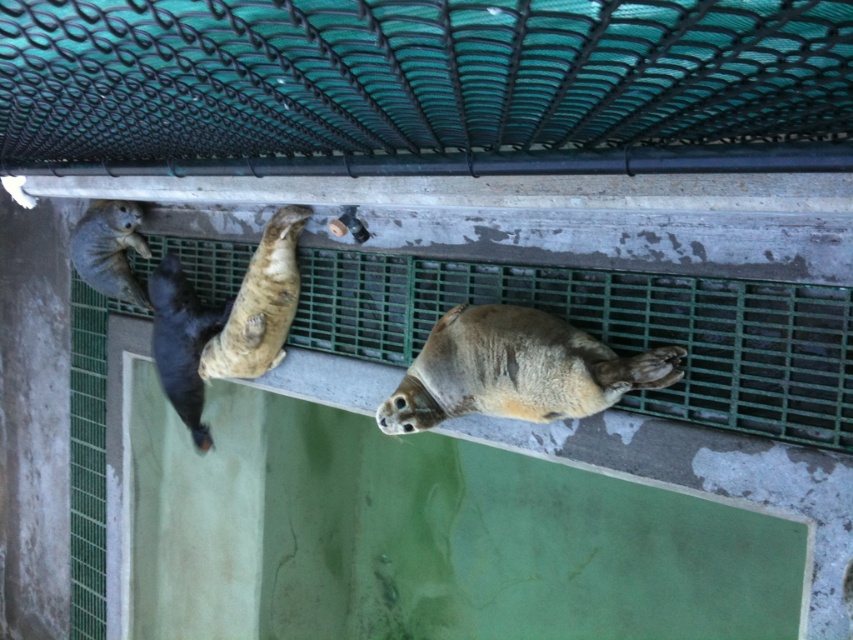
Can you confirm if black fur seal at lower left is thinner than smooth gray seal at upper left?

No.

Is black fur seal at lower left bigger than smooth gray seal at upper left?

Yes, black fur seal at lower left is bigger than smooth gray seal at upper left.

This screenshot has width=853, height=640. Identify the location of black fur seal at lower left. (181, 340).

Image resolution: width=853 pixels, height=640 pixels. Find the location of `black fur seal at lower left`. black fur seal at lower left is located at coordinates (181, 340).

In the scene shown: Is light brown fur seal at center to the left of brown fur seal at center from the viewer's perspective?

In fact, light brown fur seal at center is to the right of brown fur seal at center.

What do you see at coordinates (515, 371) in the screenshot?
I see `light brown fur seal at center` at bounding box center [515, 371].

Between point (527, 380) and point (280, 300), which one is positioned in front?

Positioned in front is point (527, 380).

The height and width of the screenshot is (640, 853). What are the coordinates of `light brown fur seal at center` in the screenshot? It's located at (515, 371).

Measure the distance between light brown fur seal at center and smooth gray seal at upper left.

The distance of light brown fur seal at center from smooth gray seal at upper left is 1.67 meters.

Between light brown fur seal at center and smooth gray seal at upper left, which one has less height?

Standing shorter between the two is light brown fur seal at center.

Where is `light brown fur seal at center`? The image size is (853, 640). light brown fur seal at center is located at coordinates (515, 371).